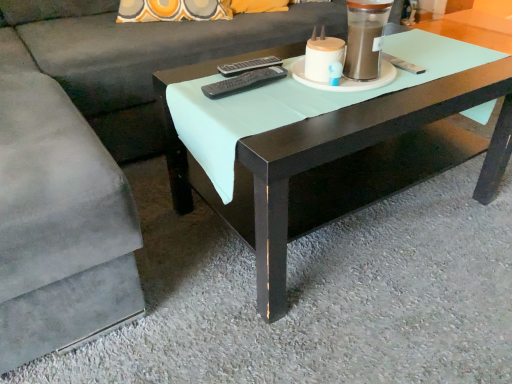
What are the coordinates of `empty space that is to the right of black plastic remote at center, the 2th remote viewed from the back` in the screenshot? It's located at (301, 93).